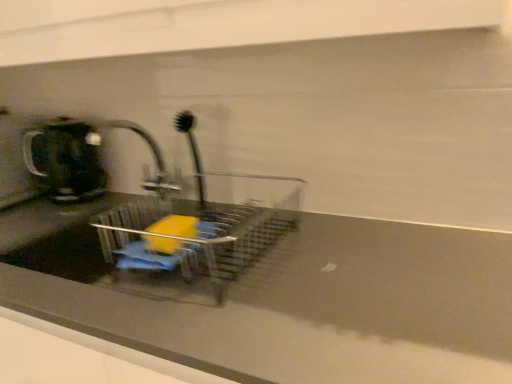
Question: Considering the positions of brushed metal tap at center and black plastic brush at center in the image, is brushed metal tap at center bigger or smaller than black plastic brush at center?

Choices:
 (A) big
 (B) small

Answer: (A)

Question: Considering their positions, is brushed metal tap at center located in front of or behind black plastic brush at center?

Choices:
 (A) behind
 (B) front

Answer: (B)

Question: Which of these objects is positioned farthest from the black plastic brush at center?

Choices:
 (A) matte gray counter top at center
 (B) brushed metal tap at center
 (C) matte black coffeepot at left
 (D) clear plastic sink at center

Answer: (C)

Question: Which is farther from the clear plastic sink at center?

Choices:
 (A) matte gray counter top at center
 (B) brushed metal tap at center
 (C) matte black coffeepot at left
 (D) black plastic brush at center

Answer: (D)